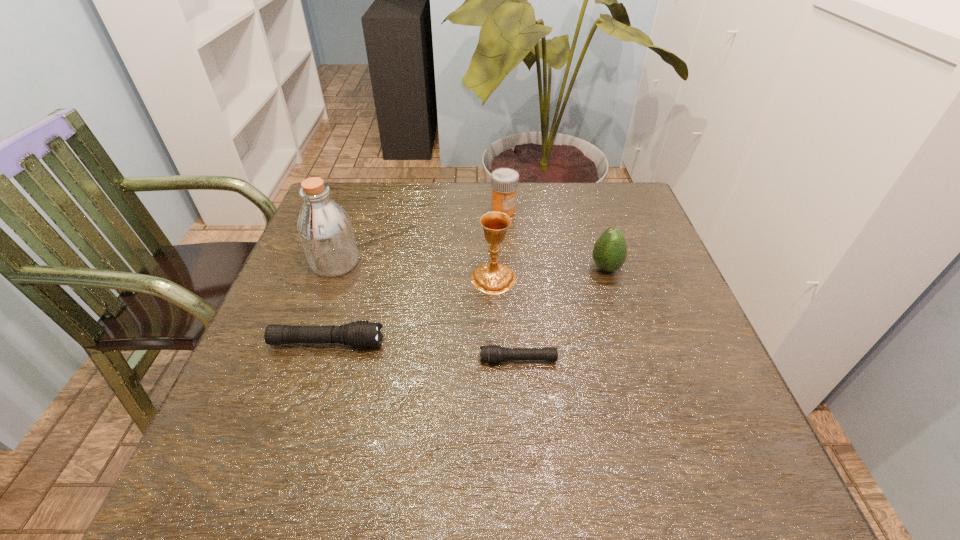
Locate an element on the screen. The height and width of the screenshot is (540, 960). the taller flashlight is located at coordinates (362, 334).

In order to click on the left flashlight in this screenshot , I will do `click(362, 334)`.

Image resolution: width=960 pixels, height=540 pixels. I want to click on the right flashlight, so click(x=489, y=354).

Locate an element on the screen. The height and width of the screenshot is (540, 960). the shorter flashlight is located at coordinates (489, 354).

At what (x,y) coordinates should I click in order to perform the action: click on medicine. Please return your answer as a coordinate pair (x, y). Looking at the image, I should click on (504, 181).

Identify the location of chalice. [493, 278].

Locate an element on the screen. Image resolution: width=960 pixels, height=540 pixels. the tallest object is located at coordinates (325, 229).

Locate an element on the screen. This screenshot has height=540, width=960. avocado is located at coordinates (609, 253).

Identify the location of vacant space located at the lens end of the second shortest object. Image resolution: width=960 pixels, height=540 pixels. (457, 343).

Identify the location of blank space located at the lens end of the shortest object. (388, 360).